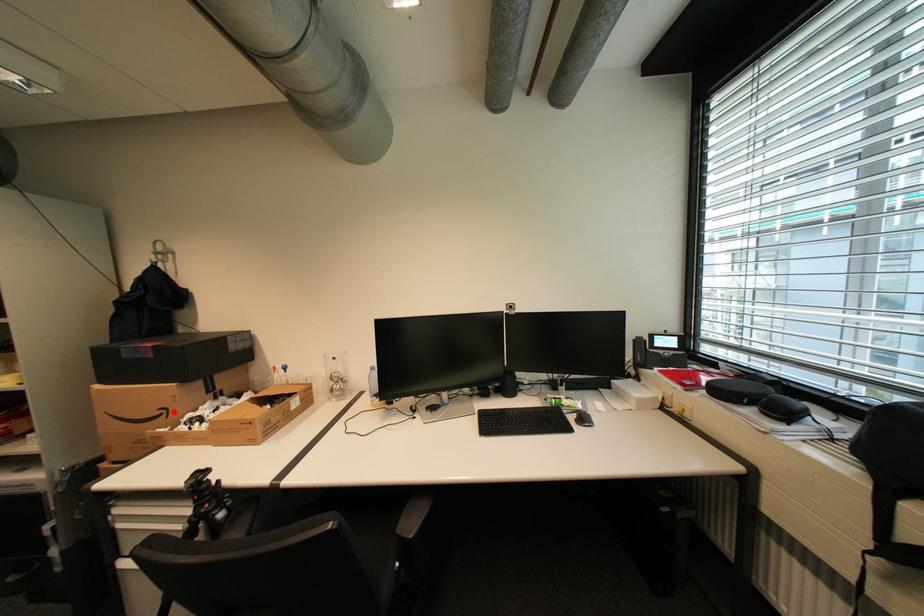
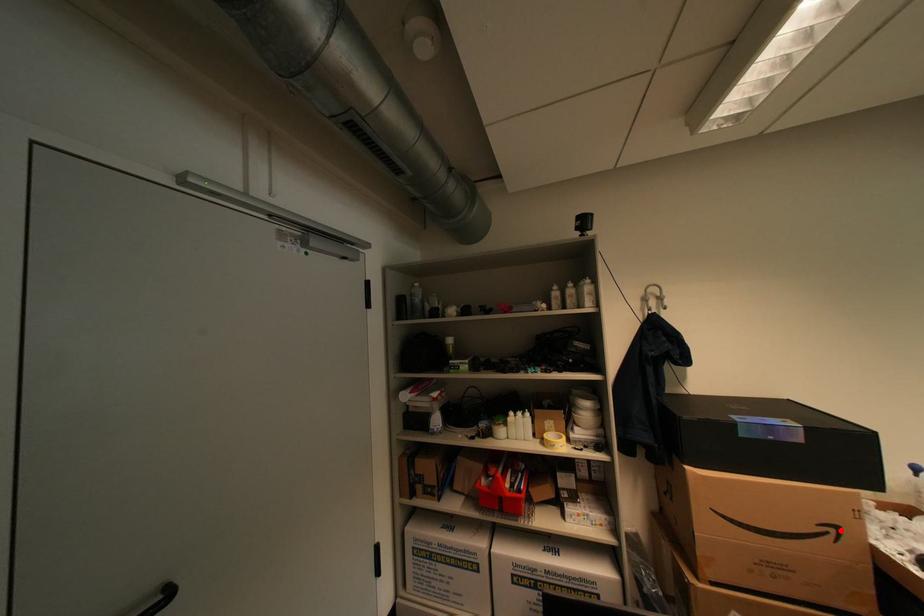
I am providing you with two images of the same scene from different viewpoints. A red point is marked on the first image and another point is marked on the second image. Do the highlighted points in image1 and image2 indicate the same real-world spot?

Yes